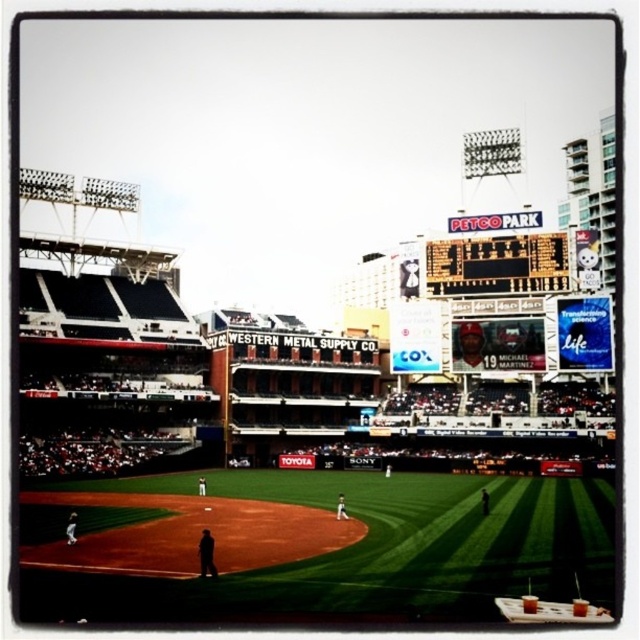
Based on the photo, can you confirm if white uniform man at center is shorter than black fabric man at center?

Correct, white uniform man at center is not as tall as black fabric man at center.

Consider the image. Which of these two, white uniform man at center or black fabric man at center, stands taller?

black fabric man at center is taller.

You are a GUI agent. You are given a task and a screenshot of the screen. Output one action in this format:
    pyautogui.click(x=<x>, y=<y>)
    Task: Click on the white uniform man at center
    
    Given the screenshot: What is the action you would take?
    pyautogui.click(x=72, y=528)

Does dark brown leather jacket at center have a greater width compared to white uniform man at center?

No.

Does point (204, 545) come in front of point (76, 522)?

That is True.

Is point (205, 561) less distant than point (67, 529)?

Yes, it is in front of point (67, 529).

I want to click on dark brown leather jacket at center, so click(x=205, y=554).

Does metallic scoreboard at upper center have a greater height compared to white uniform man at center?

Yes, metallic scoreboard at upper center is taller than white uniform man at center.

Which is behind, point (564, 288) or point (68, 516)?

The point (564, 288) is behind.

Where is `metallic scoreboard at upper center`? Image resolution: width=640 pixels, height=640 pixels. metallic scoreboard at upper center is located at coordinates (497, 264).